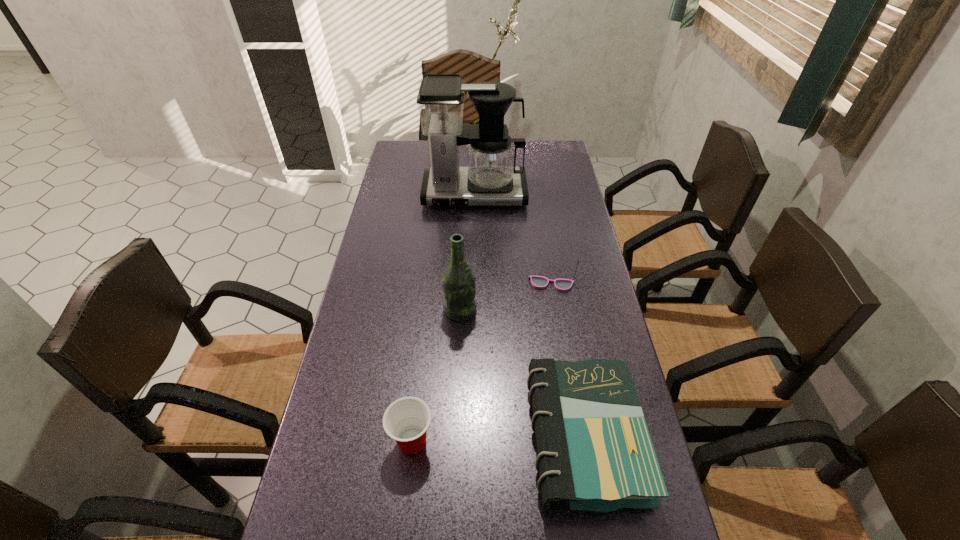
You are a GUI agent. You are given a task and a screenshot of the screen. Output one action in this format:
    pyautogui.click(x=<x>, y=<y>)
    Task: Click on the farthest object
    Image resolution: width=960 pixels, height=540 pixels.
    Given the screenshot: What is the action you would take?
    pyautogui.click(x=490, y=178)

The image size is (960, 540). Identify the location of coffee maker. (490, 178).

The height and width of the screenshot is (540, 960). I want to click on beer bottle, so click(458, 281).

You are a GUI agent. You are given a task and a screenshot of the screen. Output one action in this format:
    pyautogui.click(x=<x>, y=<y>)
    Task: Click on the third farthest object
    
    Given the screenshot: What is the action you would take?
    pyautogui.click(x=458, y=281)

Image resolution: width=960 pixels, height=540 pixels. Find the location of `the fourth nearest object`. the fourth nearest object is located at coordinates point(539,282).

Find the location of `cup`. cup is located at coordinates (406, 420).

The width and height of the screenshot is (960, 540). I want to click on paperback book, so click(x=595, y=453).

This screenshot has width=960, height=540. In order to click on blank space located 0.300m at the front of the farthest object where the controls are located in this screenshot , I will do `click(473, 271)`.

Image resolution: width=960 pixels, height=540 pixels. I want to click on vacant space located on the surface of the beer bottle, so click(x=543, y=310).

I want to click on vacant area located 0.270m on the left of the second farthest object, so click(438, 284).